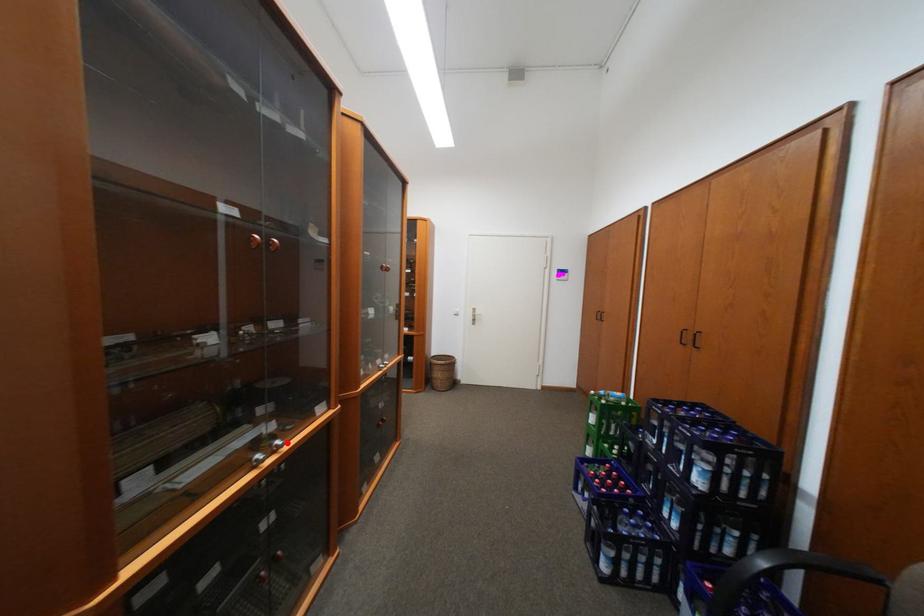
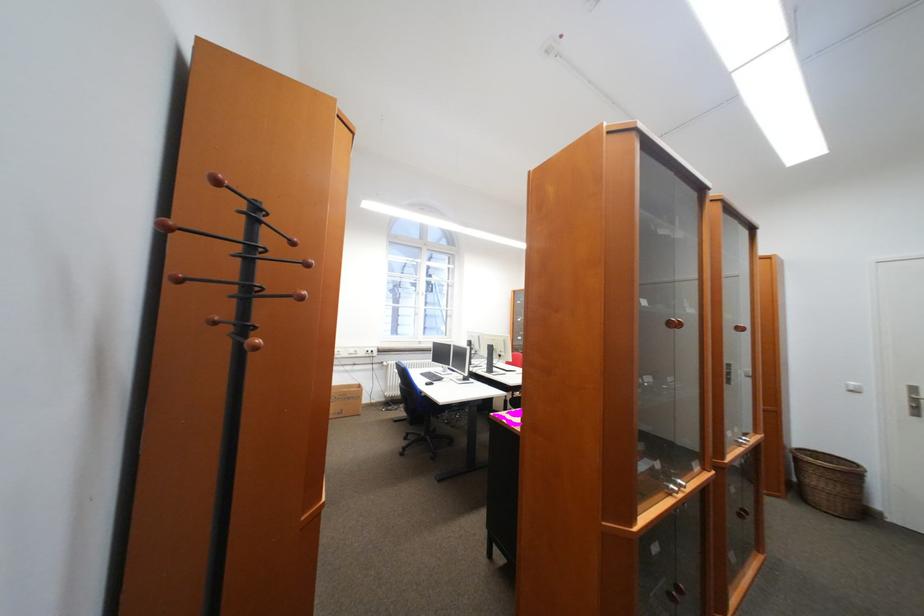
Locate, in the second image, the point that corresponds to the highlighted location in the first image.

(689, 482)